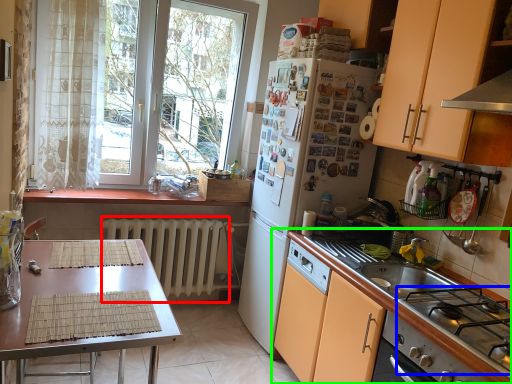
Question: Estimate the real-world distances between objects in this image. Which object is closer to radiator (highlighted by a red box), gas stove (highlighted by a blue box) or cabinetry (highlighted by a green box)?

Choices:
 (A) gas stove
 (B) cabinetry

Answer: (B)